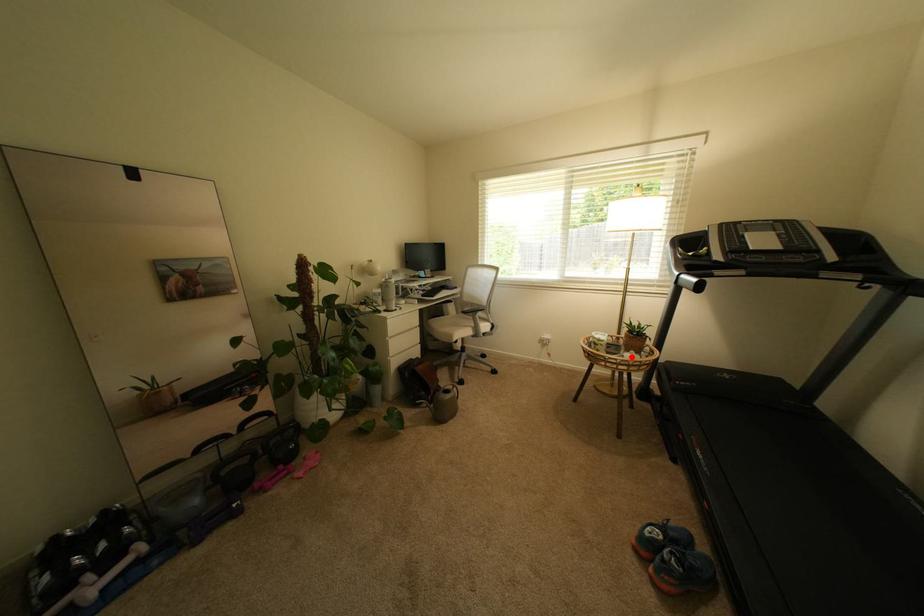
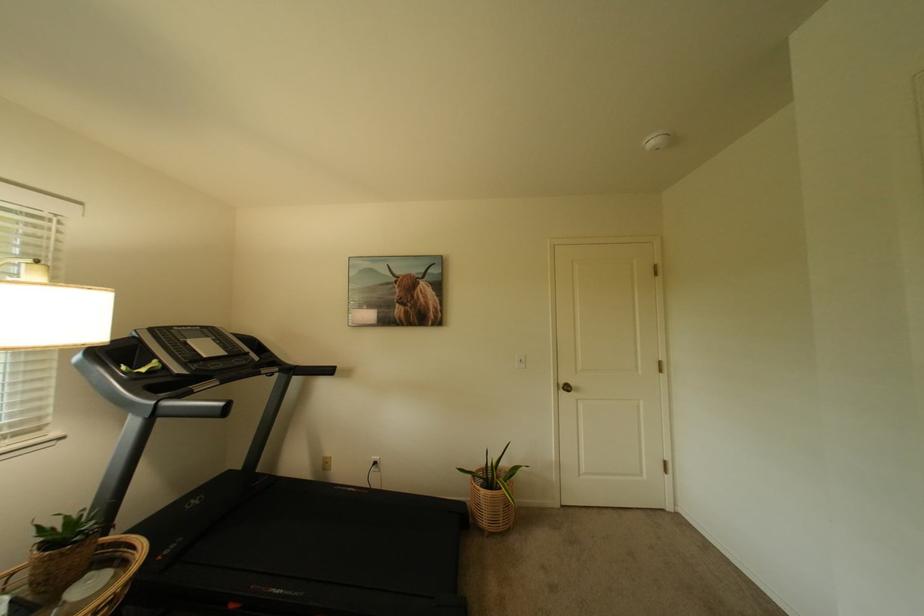
Question: A red point is marked in image1. In image2, is the corresponding 3D point closer to the camera or farther? Reply with the corresponding letter.

Choices:
 (A) The corresponding 3D point is closer.
 (B) The corresponding 3D point is farther.

Answer: (A)